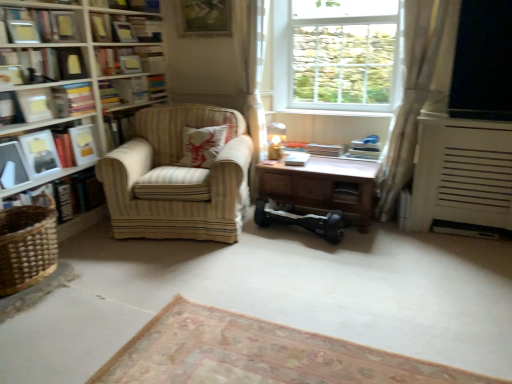
What are the coordinates of `free space to the back side of carpeted floor at lower center, the 2th plain positioned from the front` in the screenshot? It's located at (272, 279).